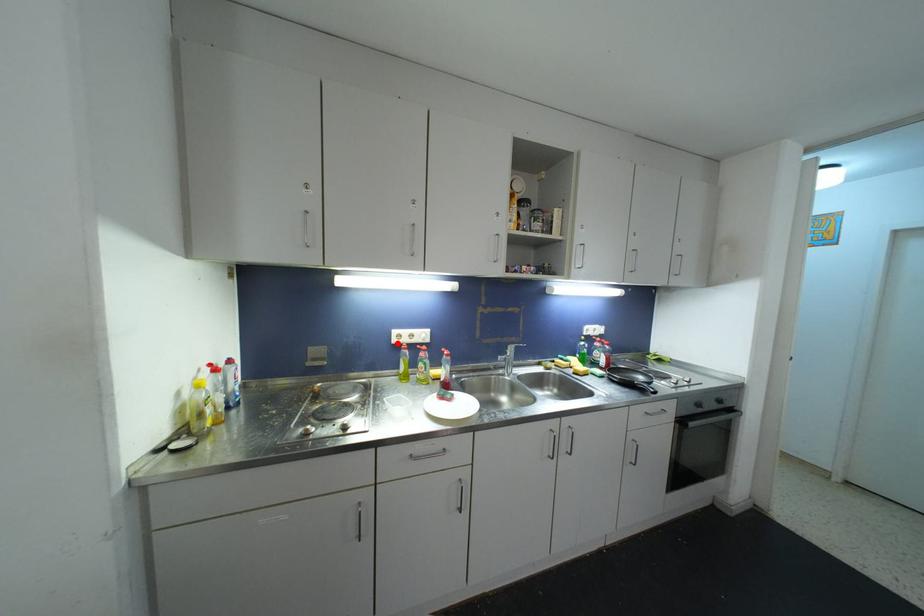
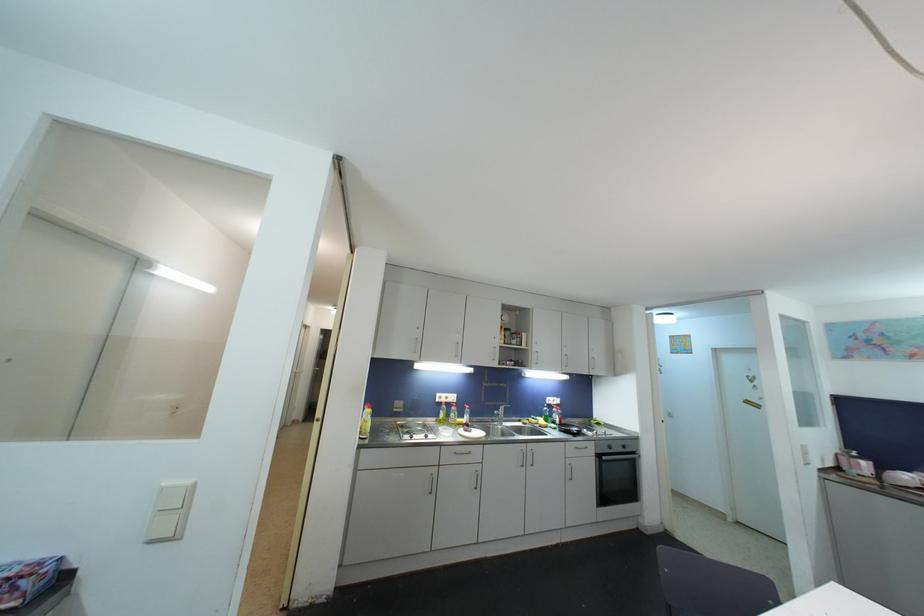
Question: I am providing you with two images of the same scene from different viewpoints. Given a red point in image1, look at the same physical point in image2. Is it:

Choices:
 (A) Closer to the viewpoint
 (B) Farther from the viewpoint

Answer: (B)